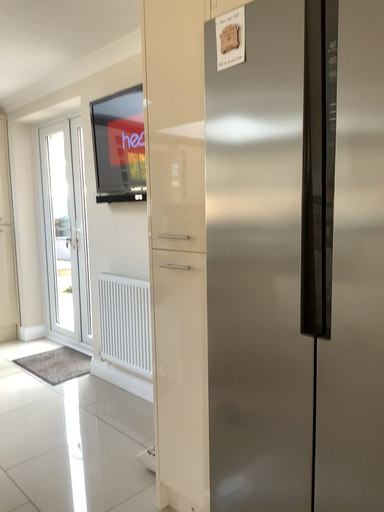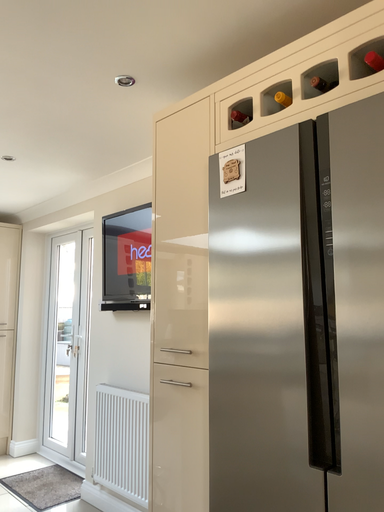
Question: How did the camera likely rotate when shooting the video?

Choices:
 (A) rotated downward
 (B) rotated upward

Answer: (B)